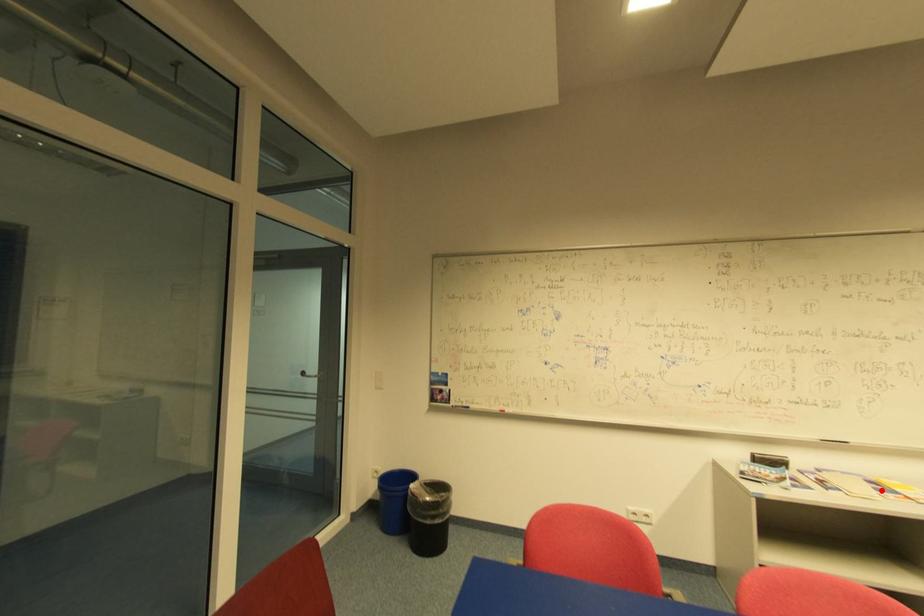
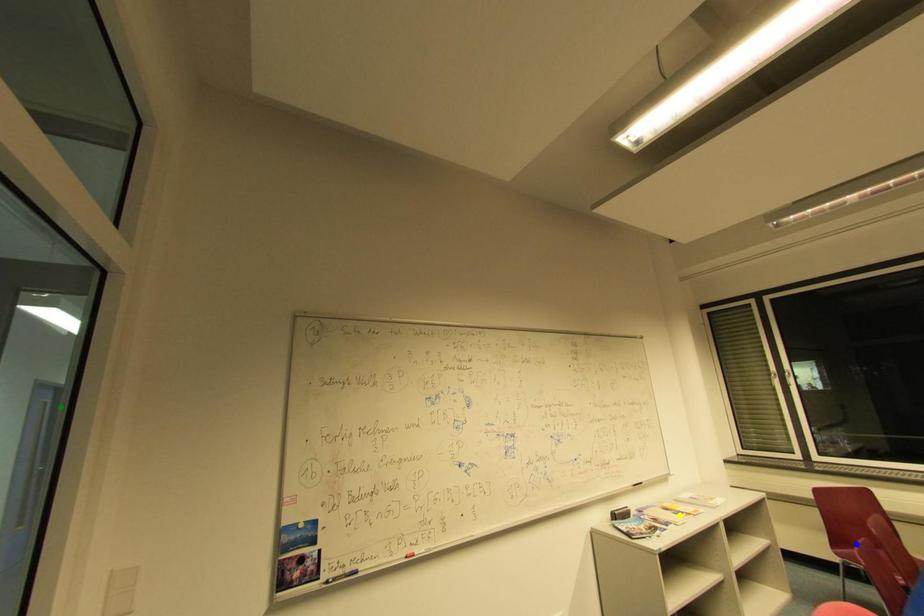
Question: I am providing you with two images of the same scene from different viewpoints. A red point is marked on the first image. You are given multiple points on the second image. Which point in image 2 represents the same 3d spot as the red point in image 1?

Choices:
 (A) blue point
 (B) green point
 (C) yellow point

Answer: (C)